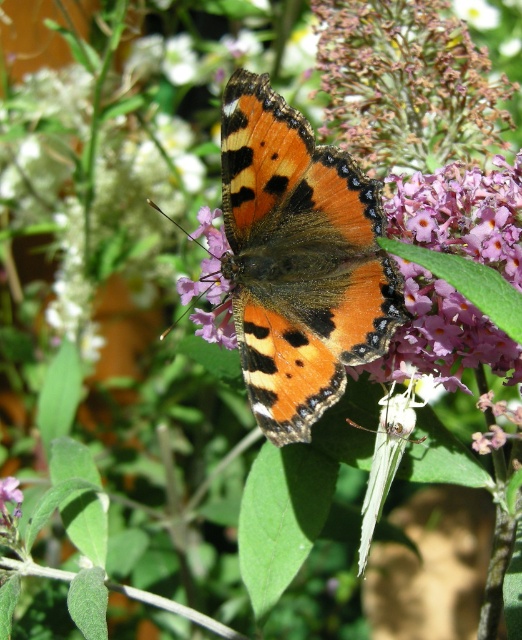
You are a photographer aiming to capture the orange matte butterfly at center and the purple matte flower at center in a single frame. Based on their sizes, will the butterfly occupy more space in the photo than the flower?

The orange matte butterfly at center might be wider than purple matte flower at center, so it could occupy more space in the photo.

You are observing a butterfly on a flower cluster. There are two points marked in the image. The first point is at coordinates point [369,316] and the second point is at point [221,314]. Which of these points is nearer to you?

Point [369,316] is closer to the viewer than point [221,314].

You are a photographer trying to capture the butterfly on the flowers. You want to place a small sticker at point [299,260] in your camera viewfinder to mark where the butterfly is. According to the scene, will this sticker be placed on the orange matte butterfly at center?

Yes, the point [299,260] is on the orange matte butterfly at center, so placing the sticker there will mark the butterfly.